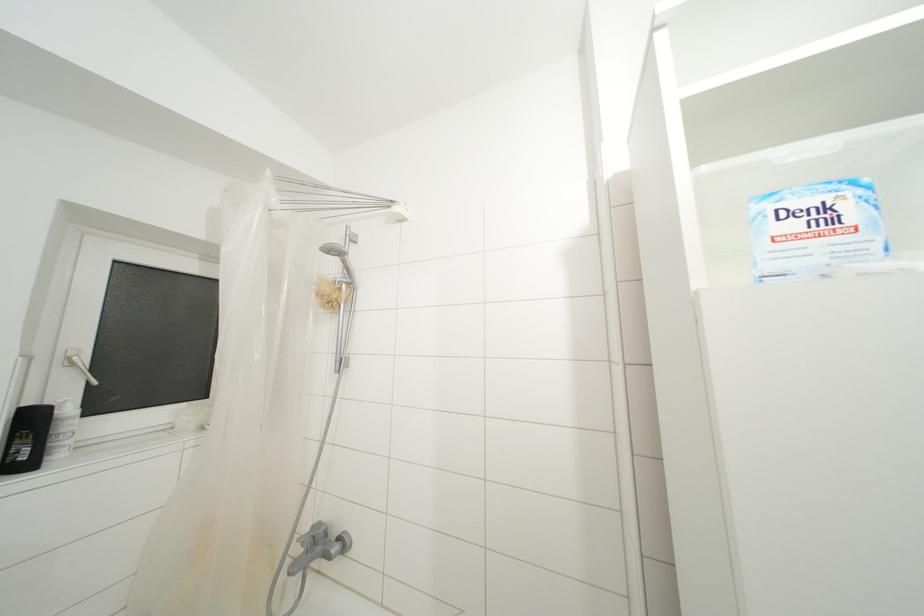
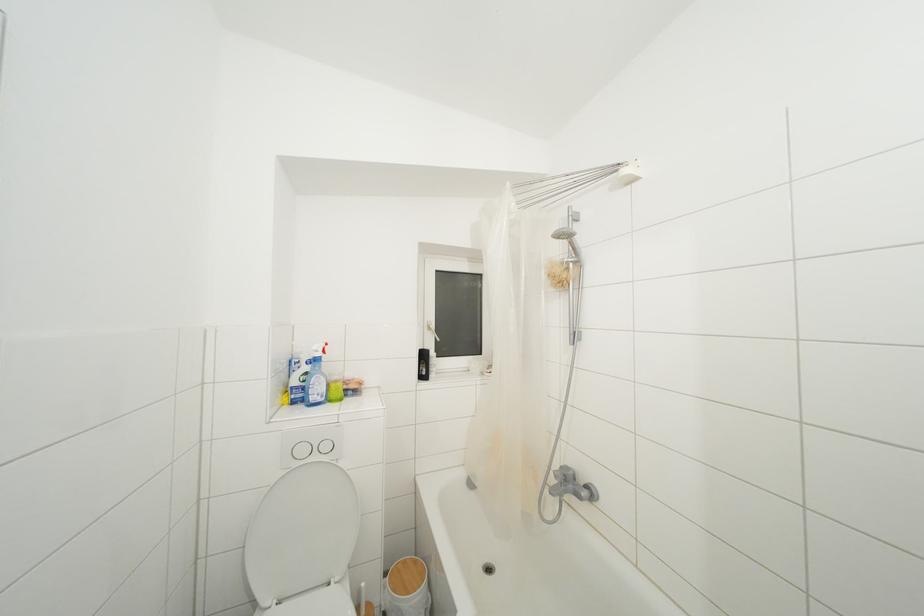
The point at (76, 368) is marked in the first image. Where is the corresponding point in the second image?

(433, 333)